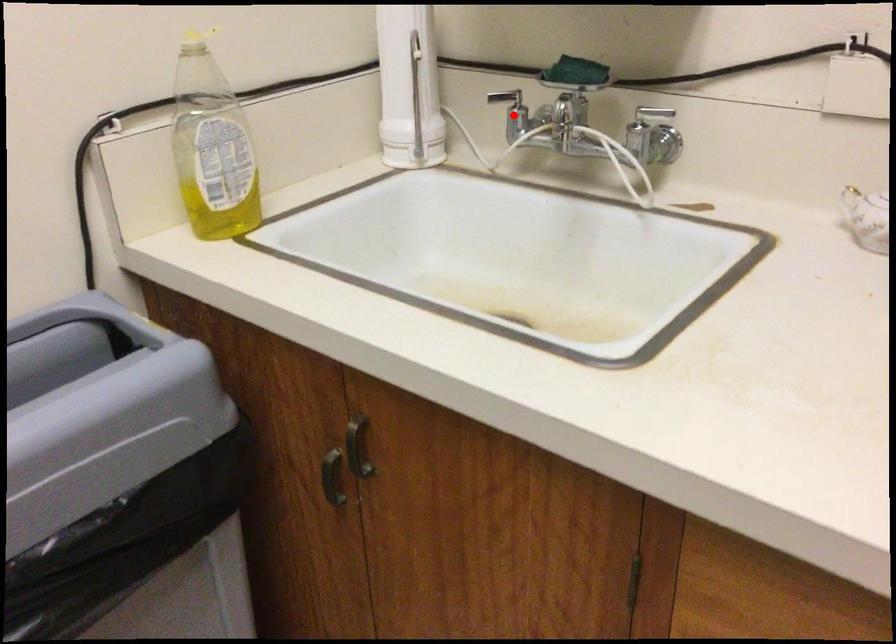
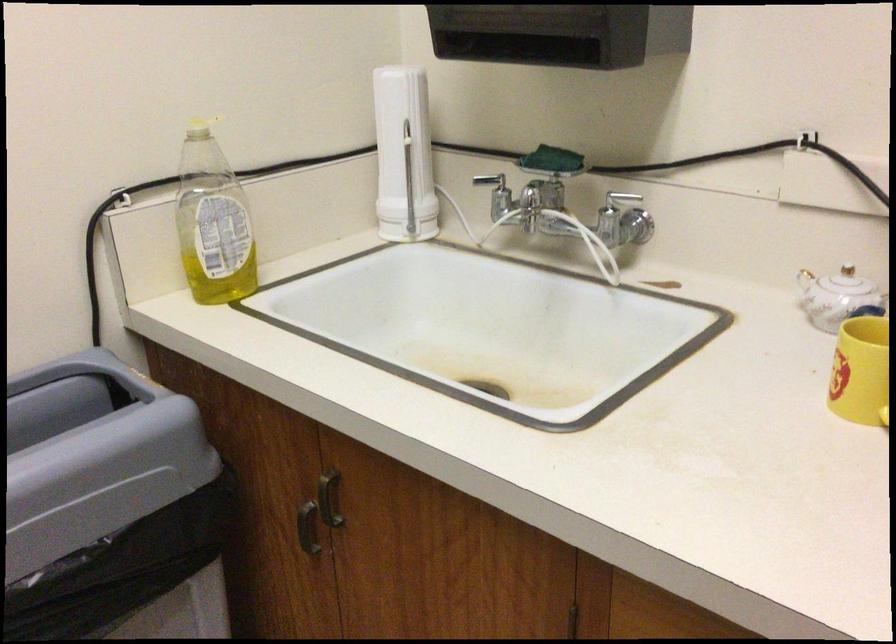
The point at the highlighted location is marked in the first image. Where is the corresponding point in the second image?

(496, 194)